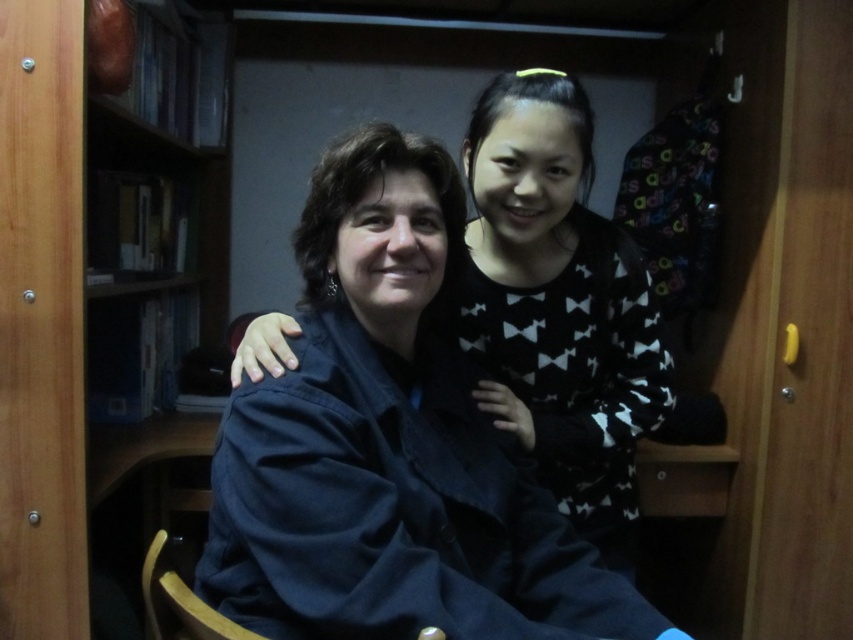
You are a delivery person standing 1 meter away from the dark blue cotton robe at center. Can you hand over a package to the person sitting next to the robe without moving closer than 1 meter?

The dark blue cotton robe at center is 76.83 centimeters away from the viewer. Since you are standing 1 meter away, you are already closer than the robe, so you can hand over the package without needing to move closer.

You are a photographer adjusting the lighting in this indoor scene. You need to ensure that both the dark blue cotton robe at center and the black matte sweater at center are evenly lit. Given their sizes, which item might require a closer light source to achieve proper exposure?

The dark blue cotton robe at center has a lesser height compared to the black matte sweater at center, so the smaller dark blue cotton robe at center might need a closer light source to ensure it receives adequate lighting and is evenly lit with the taller black matte sweater at center.

You are standing in a room where two people are sitting. You notice a dark blue cotton robe at center and a black matte sweater at center. Which one is positioned to the left?

The dark blue cotton robe at center is positioned to the left of the black matte sweater at center.